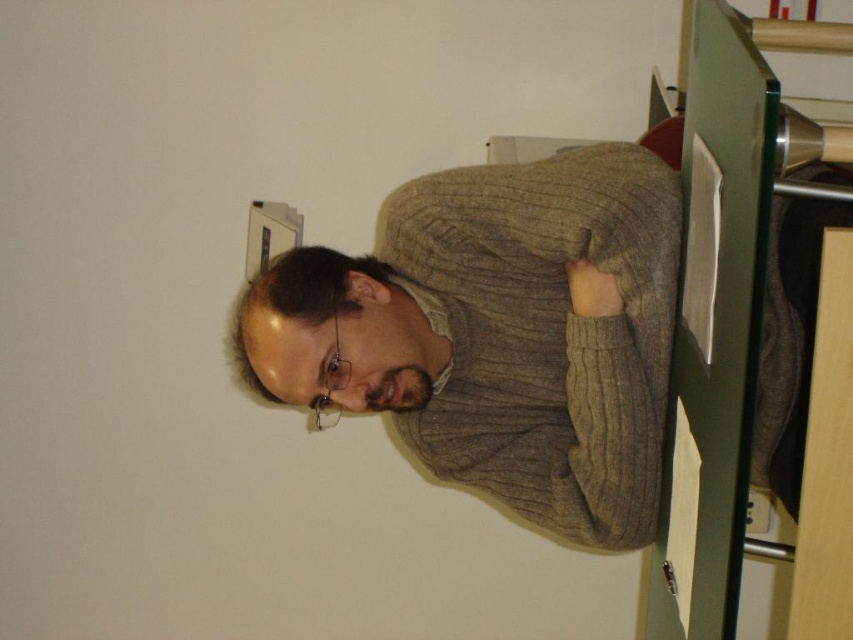
You are a tailor measuring the knitted sweater at center for alterations. The customer has a 36.96 inches chest measurement. Can the sweater accommodate the customer?

The knitted sweater at center and viewer are 36.96 inches apart from each other, but this distance refers to their spatial separation, not the sweater size. The sweater size isn not provided, so it cannot be determined if it fits the customer.